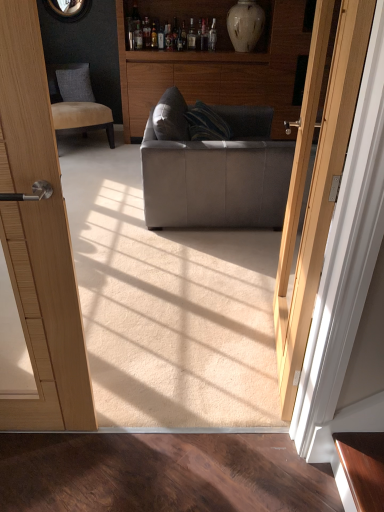
Question: Does dark gray fabric pillow at upper left appear on the left side of white glossy vase at upper center?

Choices:
 (A) yes
 (B) no

Answer: (A)

Question: Is dark gray fabric pillow at upper left oriented towards white glossy vase at upper center?

Choices:
 (A) no
 (B) yes

Answer: (A)

Question: Considering the relative sizes of dark gray fabric pillow at upper left and white glossy vase at upper center in the image provided, is dark gray fabric pillow at upper left shorter than white glossy vase at upper center?

Choices:
 (A) yes
 (B) no

Answer: (A)

Question: Is dark gray fabric pillow at upper left wider than white glossy vase at upper center?

Choices:
 (A) no
 (B) yes

Answer: (A)

Question: Is dark gray fabric pillow at upper left positioned far away from white glossy vase at upper center?

Choices:
 (A) no
 (B) yes

Answer: (B)

Question: From the image's perspective, would you say dark gray fabric pillow at upper left is positioned over white glossy vase at upper center?

Choices:
 (A) no
 (B) yes

Answer: (A)

Question: Is dark gray fabric pillow at upper left inside matte gray fabric couch at center?

Choices:
 (A) no
 (B) yes

Answer: (A)

Question: From the image's perspective, is matte gray fabric couch at center located above dark gray fabric pillow at upper left?

Choices:
 (A) no
 (B) yes

Answer: (A)

Question: Does matte gray fabric couch at center have a greater height compared to dark gray fabric pillow at upper left?

Choices:
 (A) yes
 (B) no

Answer: (A)

Question: Does matte gray fabric couch at center have a lesser height compared to dark gray fabric pillow at upper left?

Choices:
 (A) yes
 (B) no

Answer: (B)

Question: Is matte gray fabric couch at center not inside dark gray fabric pillow at upper left?

Choices:
 (A) no
 (B) yes

Answer: (B)

Question: Is matte gray fabric couch at center beside dark gray fabric pillow at upper left?

Choices:
 (A) no
 (B) yes

Answer: (A)

Question: Is wooden cabinet at center beside white glossy vase at upper center?

Choices:
 (A) no
 (B) yes

Answer: (A)